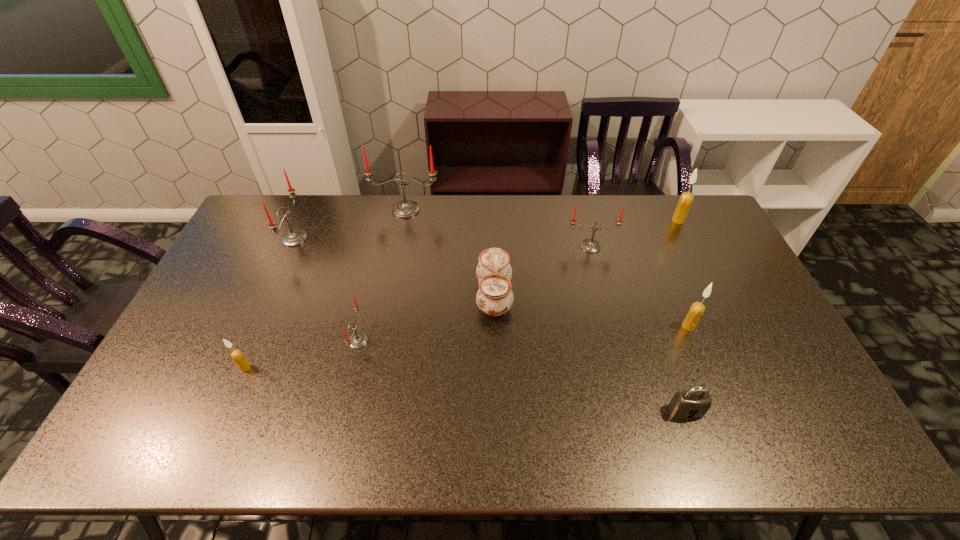
Where is `red candle that is the fourth closest to the farthest cream candle`? red candle that is the fourth closest to the farthest cream candle is located at coordinates (295, 237).

Choose which cream candle is the second nearest neighbor to the tallest object. Please provide its 2D coordinates. Your answer should be formatted as a tuple, i.e. [(x, y)], where the tuple contains the x and y coordinates of a point satisfying the conditions above.

[(686, 198)]

Where is `cream candle object that ranks as the second closest to the smallest cream candle`? cream candle object that ranks as the second closest to the smallest cream candle is located at coordinates point(686,198).

Where is `free space that satisfies the following two spatial constraints: 1. on the back side of the eighth farthest object; 2. on the front-facing side of the leftmost red candle`? free space that satisfies the following two spatial constraints: 1. on the back side of the eighth farthest object; 2. on the front-facing side of the leftmost red candle is located at coordinates (300, 238).

Where is `vacant position in the image that satisfies the following two spatial constraints: 1. on the front-facing side of the sixth object from left to right; 2. by the handle of the chinaware`? This screenshot has width=960, height=540. vacant position in the image that satisfies the following two spatial constraints: 1. on the front-facing side of the sixth object from left to right; 2. by the handle of the chinaware is located at coordinates (603, 296).

I want to click on free space that satisfies the following two spatial constraints: 1. on the front-facing side of the eighth farthest object; 2. on the left side of the leftmost red candle, so click(x=237, y=368).